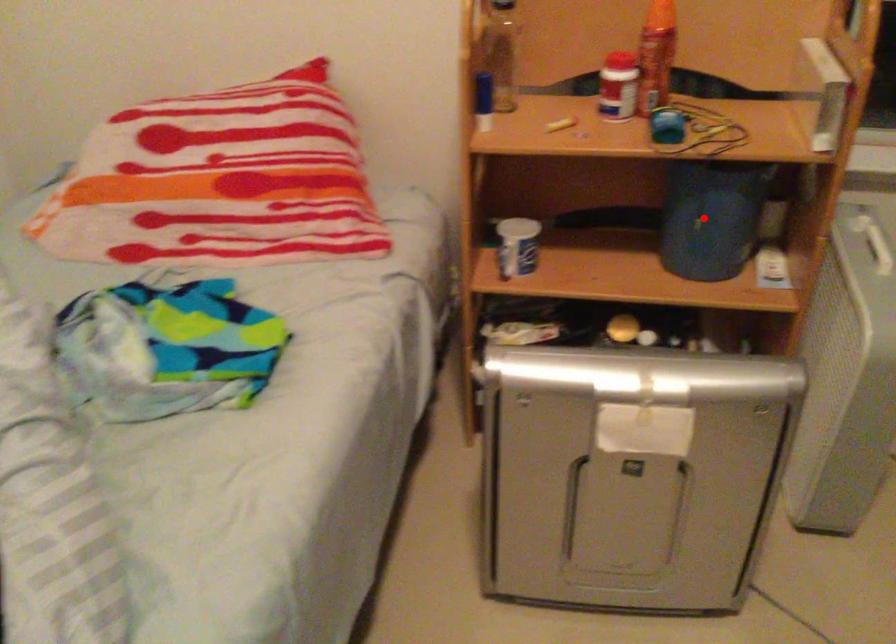
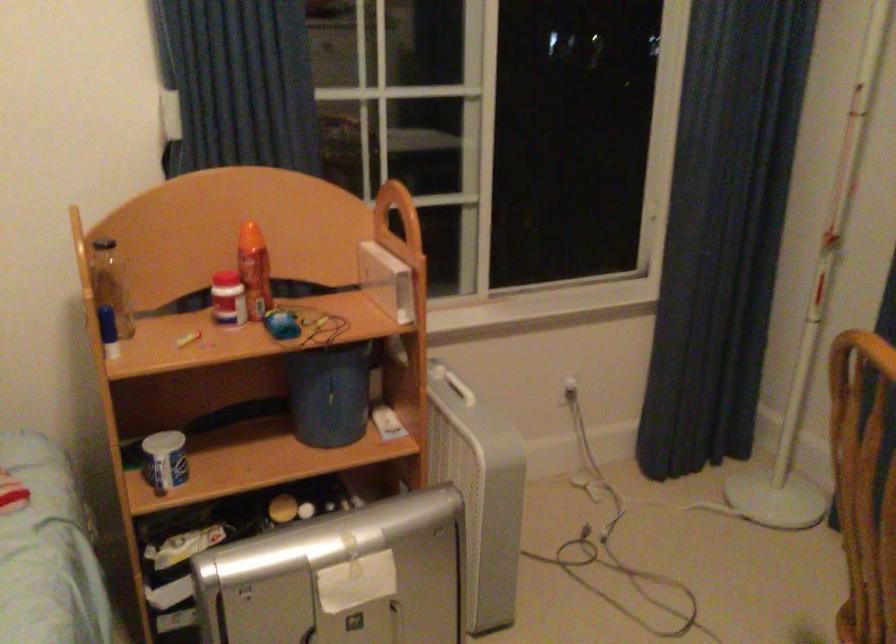
In the second image, find the point that corresponds to the highlighted location in the first image.

(331, 395)